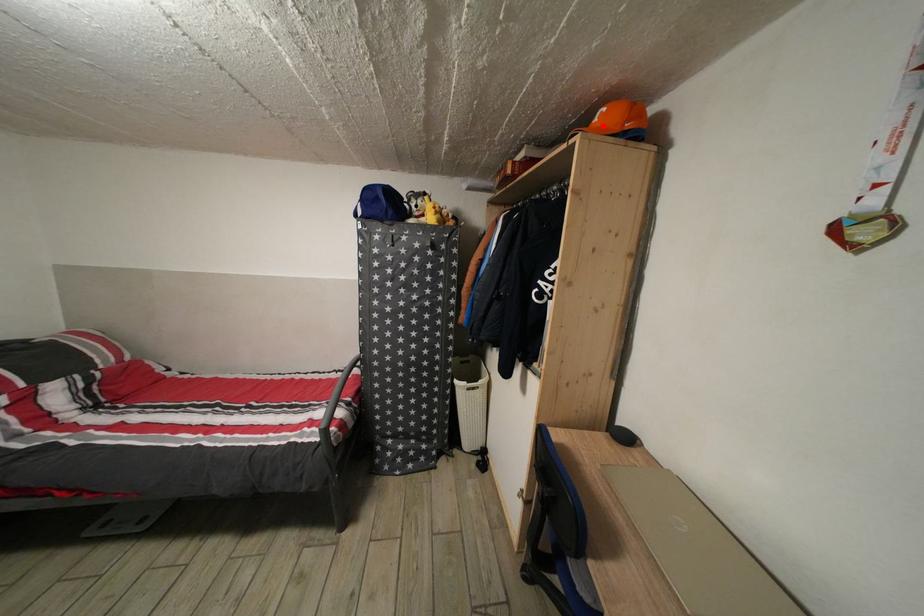
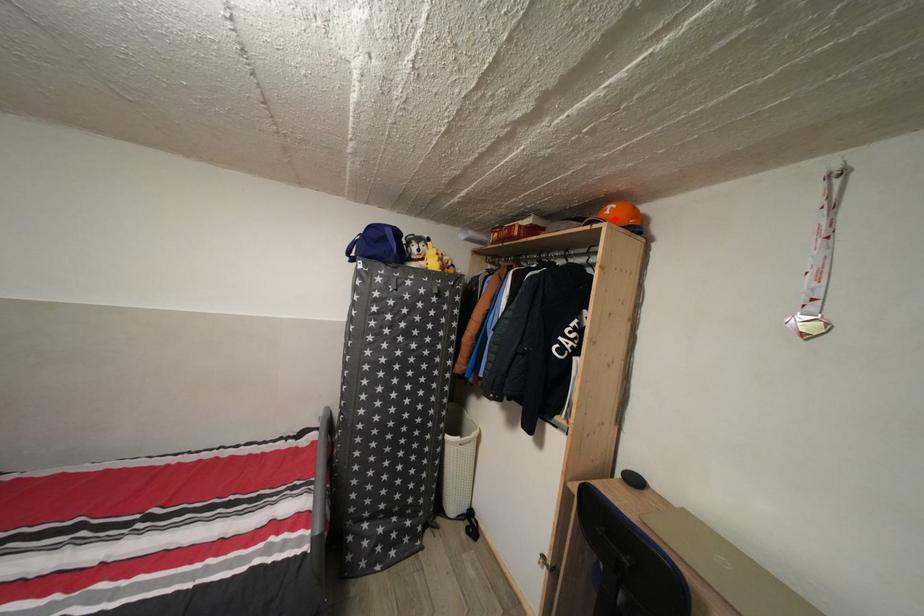
I am providing you with two images of the same scene from different viewpoints. A red point is marked on the first image and another point is marked on the second image. Is the marked point in image1 the same physical position as the marked point in image2?

Yes